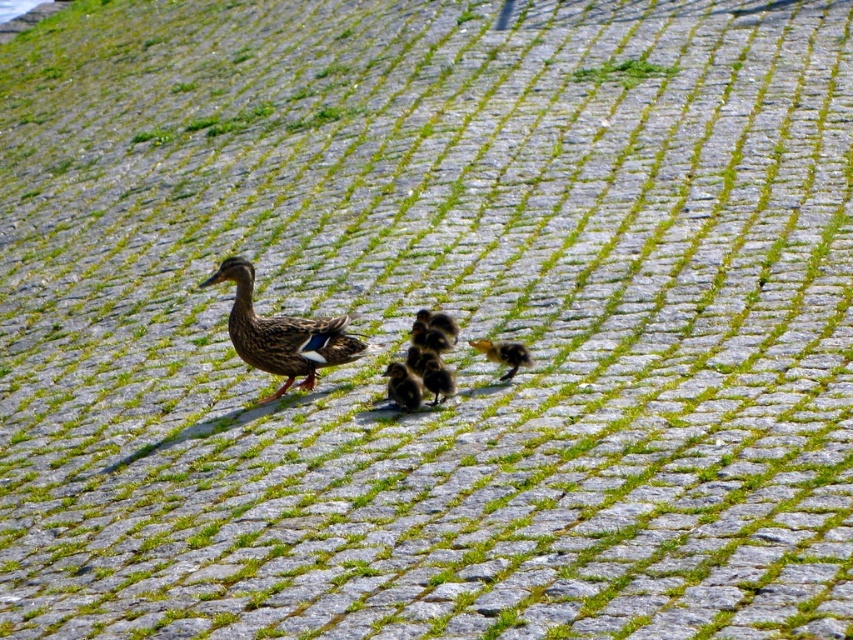
Is point (531, 358) farther from camera compared to point (428, 371)?

Yes, it is behind point (428, 371).

Is point (488, 355) positioned before point (434, 387)?

No, (488, 355) is further to viewer.

Describe the element at coordinates (503, 355) in the screenshot. The width and height of the screenshot is (853, 640). I see `yellow fuzzy duckling at center` at that location.

The image size is (853, 640). In order to click on yellow fuzzy duckling at center in this screenshot , I will do `click(503, 355)`.

Can you confirm if soft yellow duckling at center is shorter than yellow fuzzy duckling at center?

No.

Is point (396, 369) closer to viewer compared to point (509, 365)?

Yes, it is in front of point (509, 365).

What are the coordinates of `soft yellow duckling at center` in the screenshot? It's located at (403, 387).

Who is more distant from viewer, (323, 337) or (405, 388)?

The point (323, 337) is more distant.

Does brown feathered duckling at center appear on the left side of soft yellow duckling at center?

Yes, brown feathered duckling at center is to the left of soft yellow duckling at center.

Does point (268, 348) come farther from viewer compared to point (405, 401)?

Yes, it is.

Where is `brown feathered duckling at center`? The image size is (853, 640). brown feathered duckling at center is located at coordinates (282, 333).